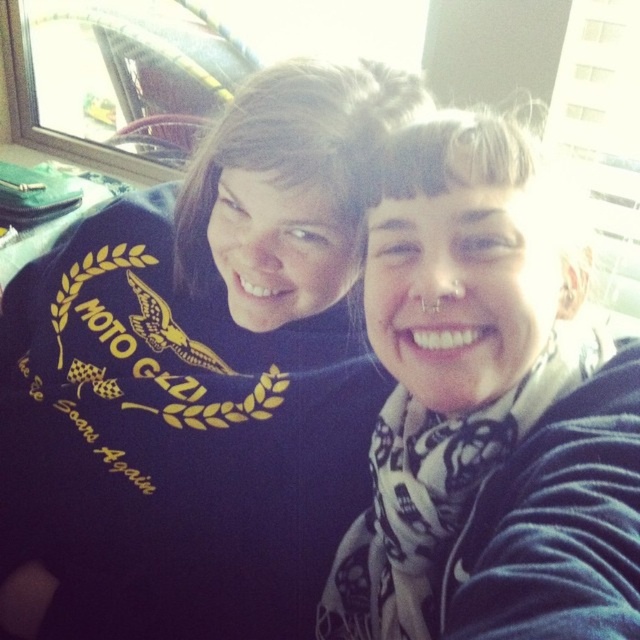
You are a photographer trying to capture a clear shot of both the dark blue sweatshirt at upper center and the white scarf at center. Based on their positions, which object is wider and might require more space in the frame?

The dark blue sweatshirt at upper center might be wider than the white scarf at center, so it requires more space in the frame.

You are taking a photo of two people standing in front of you. The first person is wearing a dark blue sweatshirt with gold lettering, and the second person is wearing a black jacket with a patterned scarf. You notice two points on their clothing that you want to focus on. The first point is at coordinate point [173,346] and the second is at point [524,259]. Which point is closer to you?

Point [524,259] is closer to you because the description states that point [173,346] is behind point [524,259].

You are trying to locate the dark blue sweatshirt at upper center in the image. What are the coordinates where you should look?

The dark blue sweatshirt at upper center is located at coordinates point (198, 380).